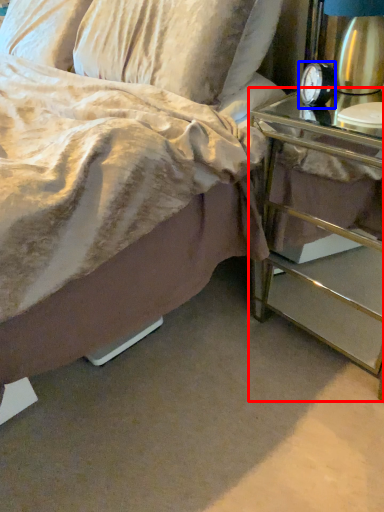
Question: Which object appears closest to the camera in this image, nightstand (highlighted by a red box) or alarm clock (highlighted by a blue box)?

Choices:
 (A) nightstand
 (B) alarm clock

Answer: (A)